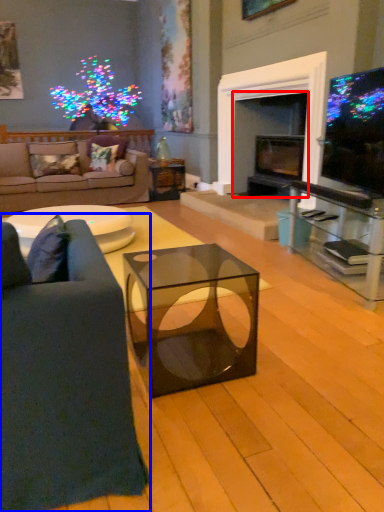
Question: Which point is further to the camera, fireplace (highlighted by a red box) or studio couch (highlighted by a blue box)?

Choices:
 (A) fireplace
 (B) studio couch

Answer: (A)